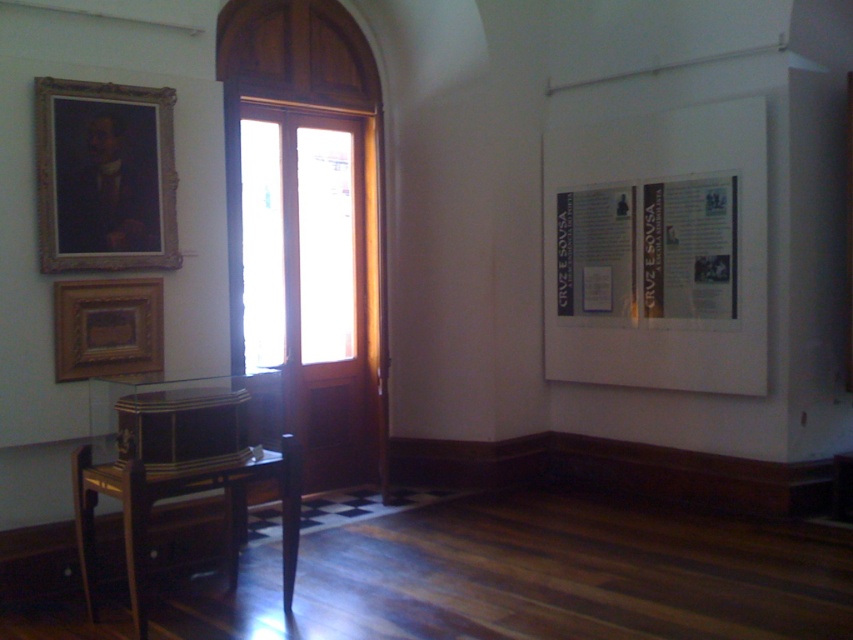
Question: Does clear glass door at center have a lesser width compared to wooden polished stool at lower left?

Choices:
 (A) no
 (B) yes

Answer: (B)

Question: Can you confirm if gold-framed portrait at upper left is thinner than wooden picture frame at lower left?

Choices:
 (A) yes
 (B) no

Answer: (B)

Question: Among these points, which one is farthest from the camera?

Choices:
 (A) (48, 198)
 (B) (99, 300)
 (C) (267, 262)
 (D) (291, 529)

Answer: (C)

Question: Which object is closer to the camera taking this photo?

Choices:
 (A) clear glass door at center
 (B) wooden picture frame at lower left

Answer: (B)

Question: Among these points, which one is farthest from the camera?

Choices:
 (A) (90, 598)
 (B) (120, 195)

Answer: (B)

Question: Is gold-framed portrait at upper left positioned behind wooden picture frame at lower left?

Choices:
 (A) no
 (B) yes

Answer: (A)